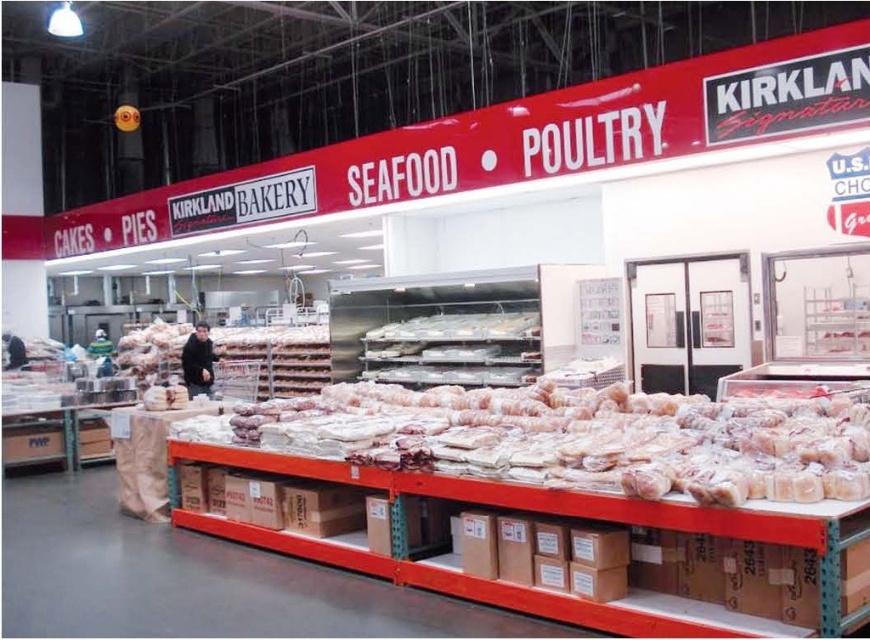
Who is more forward, [634,444] or [533,332]?

Point [634,444]

Is translucent plastic baguette at center wider than white plastic trays at center?

Indeed, translucent plastic baguette at center has a greater width compared to white plastic trays at center.

The width and height of the screenshot is (870, 640). What do you see at coordinates (574, 438) in the screenshot?
I see `translucent plastic baguette at center` at bounding box center [574, 438].

Where is `translucent plastic baguette at center`? translucent plastic baguette at center is located at coordinates (574, 438).